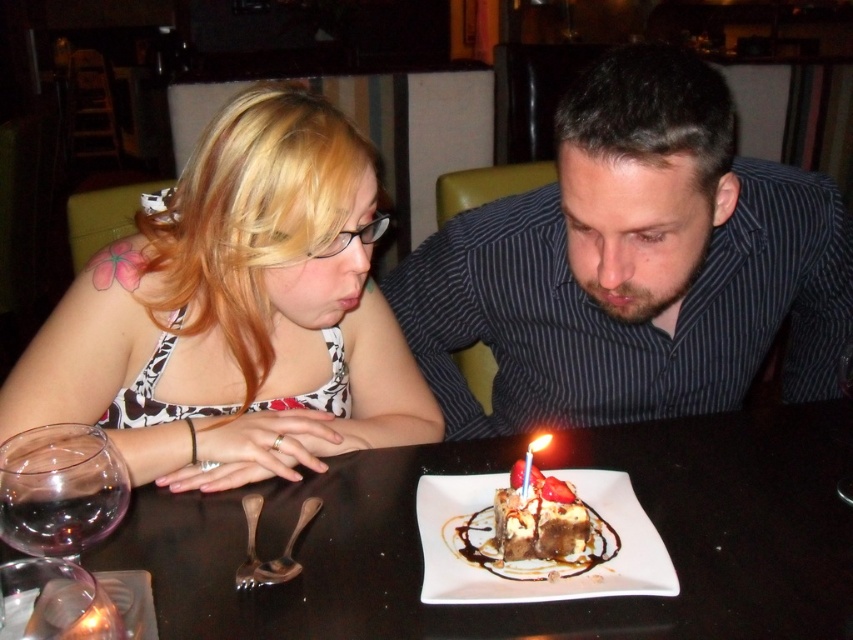
You are a waiter in a restaurant and need to place two dessert plates for a couple. The first plate should be placed at point (512, 452) and the second at point (564, 522). After placing them, which dessert plate will be closer to the couple? Explain your reasoning based on their positions.

Point (512, 452) is behind point (564, 522). Therefore, the dessert plate placed at point (564, 522) will be closer to the couple since it is positioned in front of the other plate.

You are a photographer taking a group photo of two people wearing the matte black shirt at center and the striped shirt at center. Which shirt will appear more prominent in the photo?

The matte black shirt at center will appear more prominent in the photo because it is larger in size than the striped shirt at center.

In the scene shown: You are a waiter holding a dessert tray and need to place it between the matte black tank top at left and the black glossy table at center. The tray is 20 centimeters wide. Can you fit the tray between them without moving either object?

The distance between the matte black tank top at left and the black glossy table at center is 21.95 centimeters. Since the tray is 20 centimeters wide, it can fit between them as there is enough space.